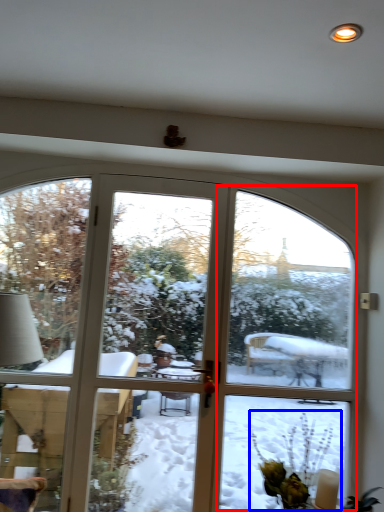
Question: Which object appears closest to the camera in this image, screen door (highlighted by a red box) or floral arrangement (highlighted by a blue box)?

Choices:
 (A) screen door
 (B) floral arrangement

Answer: (B)